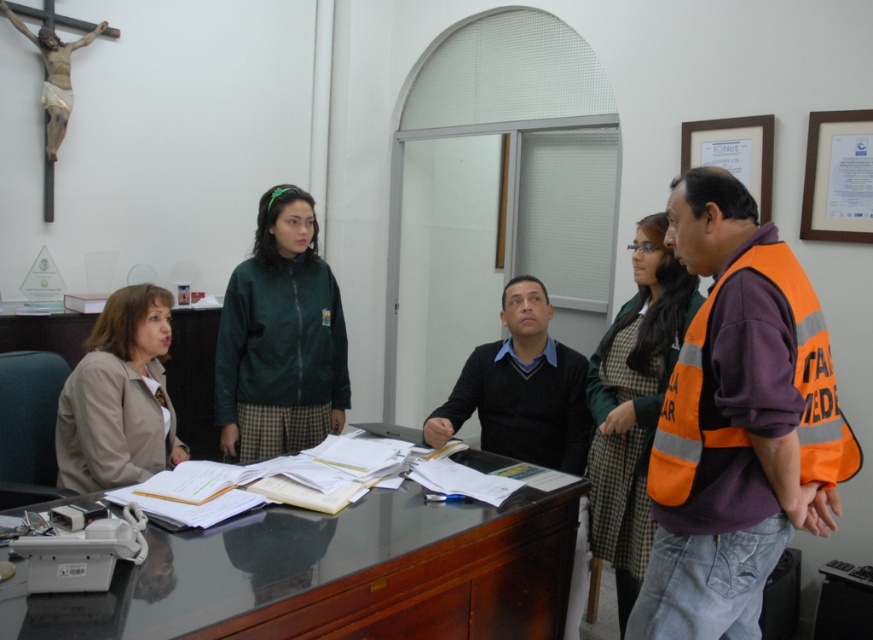
Question: Can you confirm if glossy wood table at center is positioned to the left of green matte jacket at center?

Choices:
 (A) yes
 (B) no

Answer: (B)

Question: Which of the following is the closest to the observer?

Choices:
 (A) orange reflective vest at right
 (B) glossy wood table at center
 (C) green fabric jacket at center
 (D) beige fabric jacket at left

Answer: (B)

Question: Which object is the closest to the green fabric jacket at center?

Choices:
 (A) orange reflective vest at right
 (B) black sweater at center

Answer: (B)

Question: Which is nearer to the glossy wood table at center?

Choices:
 (A) green matte jacket at center
 (B) green fabric jacket at center
 (C) orange reflective vest at right

Answer: (B)

Question: Is glossy wood table at center positioned at the back of green fabric jacket at center?

Choices:
 (A) yes
 (B) no

Answer: (B)

Question: Can you confirm if green fabric jacket at center is wider than black sweater at center?

Choices:
 (A) yes
 (B) no

Answer: (B)